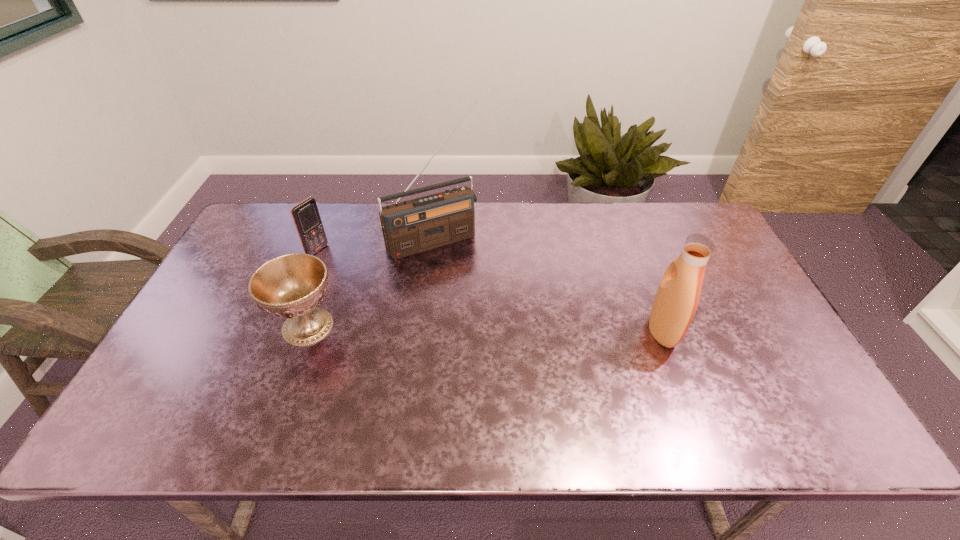
Identify the location of free area in between the detergent and the cellular telephone. The width and height of the screenshot is (960, 540). [490, 291].

This screenshot has height=540, width=960. I want to click on vacant area that lies between the cellular telephone and the radio receiver, so click(375, 245).

Find the location of a particular element. The width and height of the screenshot is (960, 540). object that is the closest to the third object from left to right is located at coordinates (306, 216).

I want to click on object that is the nearest to the rightmost object, so click(x=409, y=227).

The height and width of the screenshot is (540, 960). I want to click on blank area in the image that satisfies the following two spatial constraints: 1. on the front side of the cellular telephone; 2. on the right side of the chalice, so click(x=286, y=327).

What are the coordinates of `free location that satisfies the following two spatial constraints: 1. on the front side of the cellular telephone; 2. on the front-facing side of the rightmost object` in the screenshot? It's located at (284, 331).

Find the location of a particular element. This screenshot has width=960, height=540. vacant space that satisfies the following two spatial constraints: 1. on the front side of the cellular telephone; 2. on the right side of the chalice is located at coordinates (286, 327).

The height and width of the screenshot is (540, 960). I want to click on free spot that satisfies the following two spatial constraints: 1. on the front side of the rightmost object; 2. on the front-facing side of the cellular telephone, so click(284, 331).